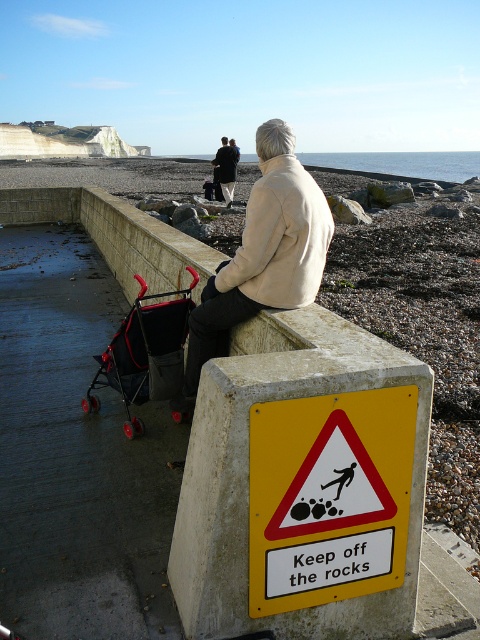
Question: Which object appears farthest from the camera in this image?

Choices:
 (A) yellow metal sign at center
 (B) dark blue jeans at center

Answer: (B)

Question: Is black mesh stroller at lower left thinner than dark blue jeans at center?

Choices:
 (A) yes
 (B) no

Answer: (B)

Question: Does yellow metal sign at center have a smaller size compared to beige woolen jacket at center?

Choices:
 (A) yes
 (B) no

Answer: (A)

Question: Can you confirm if beige woolen jacket at center is thinner than black mesh stroller at lower left?

Choices:
 (A) yes
 (B) no

Answer: (B)

Question: Which point is closer to the camera?

Choices:
 (A) dark blue jeans at center
 (B) beige woolen jacket at center

Answer: (B)

Question: Estimate the real-world distances between objects in this image. Which object is farther from the black mesh stroller at lower left?

Choices:
 (A) yellow metal sign at center
 (B) beige woolen jacket at center
 (C) dark blue jeans at center

Answer: (C)